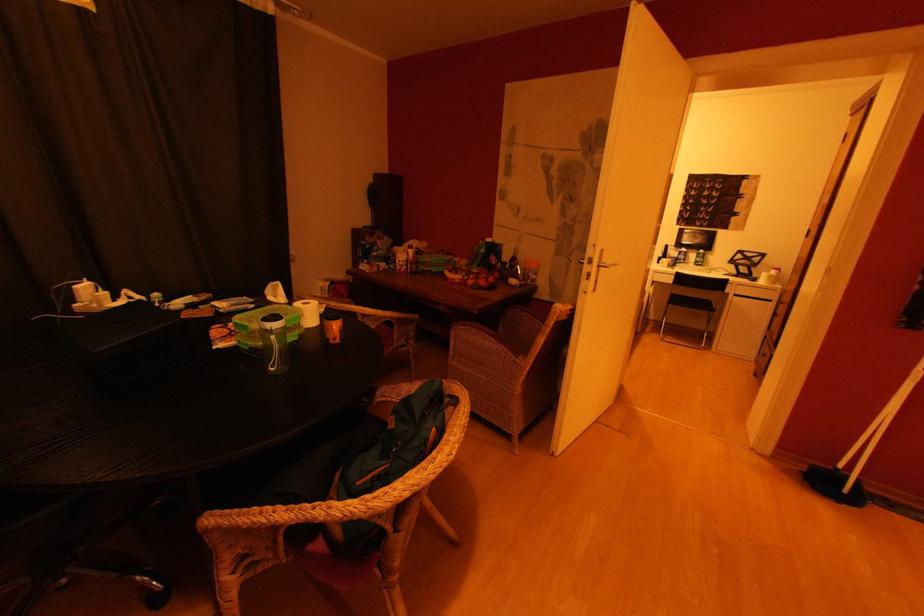
Find where to lift the red fruit bowl. Please return your answer as a coordinate pair (x, y).

(481, 278)